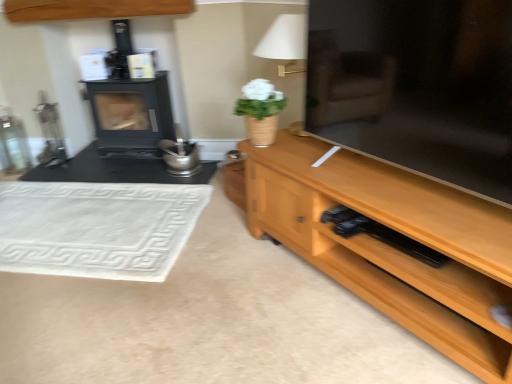
Image resolution: width=512 pixels, height=384 pixels. What are the coordinates of `empty space that is ontop of wooden tv stand at right (from a real-world perspective)` in the screenshot? It's located at (129, 243).